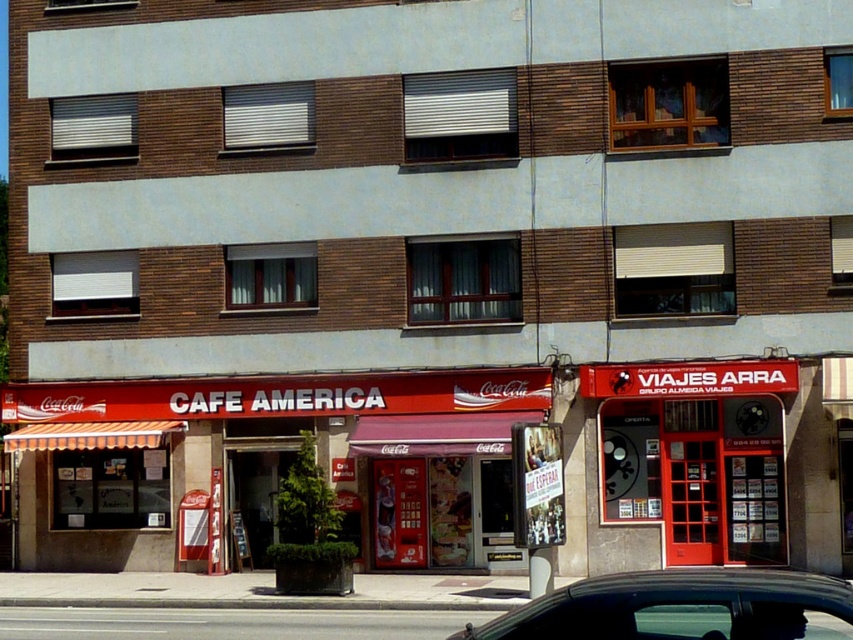
Question: Is red glass door at right to the left of black glossy car at lower center from the viewer's perspective?

Choices:
 (A) yes
 (B) no

Answer: (B)

Question: Is red glass door at right thinner than black glossy car at lower center?

Choices:
 (A) no
 (B) yes

Answer: (B)

Question: Which point appears farthest from the camera in this image?

Choices:
 (A) (619, 628)
 (B) (764, 364)

Answer: (B)

Question: Does red glass door at right have a larger size compared to black glossy car at lower center?

Choices:
 (A) no
 (B) yes

Answer: (A)